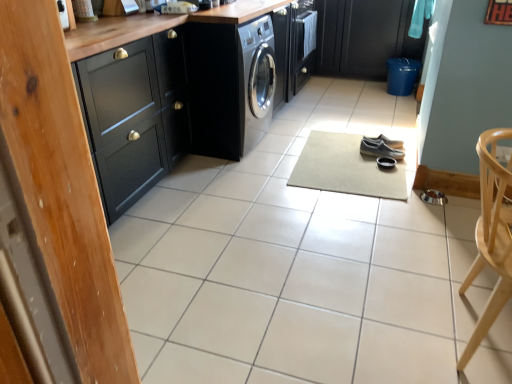
Locate an element on the screen. This screenshot has width=512, height=384. free space in front of beige carpet at center is located at coordinates tap(405, 235).